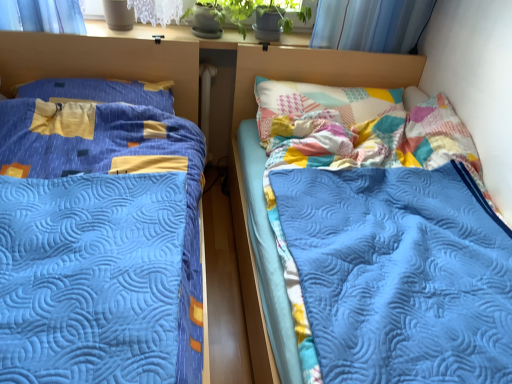
Find the location of a particular element. Image resolution: width=512 pixels, height=384 pixels. blue quilted bed at right, which is the second bed from left to right is located at coordinates (255, 143).

Describe the element at coordinates (255, 143) in the screenshot. I see `blue quilted bed at right, which is the second bed from left to right` at that location.

What is the approximate width of blue quilted bed at left, arranged as the 2th bed when viewed from the right?

It is 1.70 meters.

Measure the distance between point (172,45) and camera.

A distance of 6.53 feet exists between point (172,45) and camera.

Measure the distance between patchwork fabric headboard at upper right and camera.

The distance of patchwork fabric headboard at upper right from camera is 6.75 feet.

What do you see at coordinates (100, 91) in the screenshot? This screenshot has height=384, width=512. I see `matte blue pillow at left` at bounding box center [100, 91].

Find the location of `matte blue pillow at left`. matte blue pillow at left is located at coordinates (100, 91).

At what (x,y) coordinates should I click in order to perform the action: click on white matte radiator at center. Please return your answer as a coordinate pair (x, y). Looking at the image, I should click on (206, 101).

Which is correct: blue quilted bed at left, which is the 1th bed in left-to-right order, is inside patchwork fabric headboard at upper right, or outside of it?

blue quilted bed at left, which is the 1th bed in left-to-right order, lies outside patchwork fabric headboard at upper right.

How many degrees apart are the facing directions of blue quilted bed at left, arranged as the 2th bed when viewed from the right, and patchwork fabric headboard at upper right?

The angular difference between blue quilted bed at left, arranged as the 2th bed when viewed from the right, and patchwork fabric headboard at upper right is 0.00856 degrees.

Which bed is the 2nd one when counting from the front of the patchwork fabric headboard at upper right? Please provide its 2D coordinates.

[(106, 60)]

From a real-world perspective, is blue quilted bed at left, arranged as the 2th bed when viewed from the right, under patchwork fabric headboard at upper right?

Correct, in the physical world, blue quilted bed at left, arranged as the 2th bed when viewed from the right, is lower than patchwork fabric headboard at upper right.

Which is more to the right, matte blue pillow at left or blue quilted bed at left, arranged as the 2th bed when viewed from the right?

Positioned to the right is blue quilted bed at left, arranged as the 2th bed when viewed from the right.

Is matte blue pillow at left positioned before blue quilted bed at left, which is the 1th bed in left-to-right order?

No, matte blue pillow at left is behind blue quilted bed at left, which is the 1th bed in left-to-right order.

Could you tell me if matte blue pillow at left is turned towards blue quilted bed at left, arranged as the 2th bed when viewed from the right?

Yes, matte blue pillow at left is turned towards blue quilted bed at left, arranged as the 2th bed when viewed from the right.

From the image's perspective, between matte blue pillow at left and blue quilted bed at left, which is the 1th bed in left-to-right order, which one is located above?

matte blue pillow at left.

From the image's perspective, which object appears higher, white matte radiator at center or patchwork fabric headboard at upper right?

white matte radiator at center is shown above in the image.

Where is `radiator below the patchwork fabric headboard at upper right (from a real-world perspective)`? radiator below the patchwork fabric headboard at upper right (from a real-world perspective) is located at coordinates (206, 101).

Can you confirm if white matte radiator at center is positioned to the left of patchwork fabric headboard at upper right?

Yes.

Is matte blue pillow at left thinner than white matte radiator at center?

No, matte blue pillow at left is not thinner than white matte radiator at center.

From a real-world perspective, is matte blue pillow at left under white matte radiator at center?

Incorrect, from a real-world perspective, matte blue pillow at left is higher than white matte radiator at center.

From the picture: Is matte blue pillow at left situated inside white matte radiator at center or outside?

matte blue pillow at left lies outside white matte radiator at center.

Could you tell me if blue quilted bed at left, which is the 1th bed in left-to-right order, is turned towards matte blue pillow at left?

No, blue quilted bed at left, which is the 1th bed in left-to-right order, does not turn towards matte blue pillow at left.

How different are the orientations of blue quilted bed at left, arranged as the 2th bed when viewed from the right, and matte blue pillow at left in degrees?

The angle between the facing direction of blue quilted bed at left, arranged as the 2th bed when viewed from the right, and the facing direction of matte blue pillow at left is 2.97e-05 degrees.

Is blue quilted bed at left, arranged as the 2th bed when viewed from the right, closer to the viewer compared to matte blue pillow at left?

Yes, it is.

Considering the relative sizes of blue quilted bed at left, which is the 1th bed in left-to-right order, and matte blue pillow at left in the image provided, is blue quilted bed at left, which is the 1th bed in left-to-right order, thinner than matte blue pillow at left?

In fact, blue quilted bed at left, which is the 1th bed in left-to-right order, might be wider than matte blue pillow at left.

Would you say matte blue pillow at left is inside or outside blue quilted bed at right, which is the first bed from right to left?

matte blue pillow at left is outside blue quilted bed at right, which is the first bed from right to left.

Is matte blue pillow at left with blue quilted bed at right, which is the first bed from right to left?

No, matte blue pillow at left is not with blue quilted bed at right, which is the first bed from right to left.

Which is more distant, (56, 99) or (240, 214)?

The point (240, 214) is more distant.

Looking at the image, does matte blue pillow at left seem bigger or smaller compared to blue quilted bed at right, which is the first bed from right to left?

Clearly, matte blue pillow at left is smaller in size than blue quilted bed at right, which is the first bed from right to left.

Locate an element on the screen. pillow positioned vertically above the patchwork fabric headboard at upper right (from a real-world perspective) is located at coordinates (100, 91).

From a real-world perspective, is matte blue pillow at left above or below patchwork fabric headboard at upper right?

In terms of real-world spatial position, matte blue pillow at left is above patchwork fabric headboard at upper right.

Is matte blue pillow at left not inside patchwork fabric headboard at upper right?

Yes, matte blue pillow at left is not within patchwork fabric headboard at upper right.

At what (x,y) coordinates should I click in order to perform the action: click on the 1st bed positioned below the patchwork fabric headboard at upper right (from the image's perspective). Please return your answer as a coordinate pair (x, y). The height and width of the screenshot is (384, 512). Looking at the image, I should click on (106, 60).

From a real-world perspective, starting from the matte blue pillow at left, which bed is the 1st one below it? Please provide its 2D coordinates.

[(106, 60)]

Based on the photo, based on their spatial positions, is white matte radiator at center or matte blue pillow at left closer to patchwork fabric headboard at upper right?

white matte radiator at center lies closer to patchwork fabric headboard at upper right than the other object.

Based on their spatial positions, is patchwork fabric headboard at upper right or blue quilted bed at left, which is the 1th bed in left-to-right order, closer to white matte radiator at center?

The object closer to white matte radiator at center is blue quilted bed at left, which is the 1th bed in left-to-right order.

Which object lies further to the anchor point blue quilted bed at left, arranged as the 2th bed when viewed from the right, white matte radiator at center or matte blue pillow at left?

white matte radiator at center is positioned further to the anchor blue quilted bed at left, arranged as the 2th bed when viewed from the right.

Considering their positions, is matte blue pillow at left positioned closer to blue quilted bed at right, which is the first bed from right to left, than patchwork fabric headboard at upper right?

The object closer to blue quilted bed at right, which is the first bed from right to left, is patchwork fabric headboard at upper right.

From the picture: When comparing their distances from blue quilted bed at left, arranged as the 2th bed when viewed from the right, does white matte radiator at center or blue quilted bed at right, which is the second bed from left to right, seem closer?

white matte radiator at center is closer to blue quilted bed at left, arranged as the 2th bed when viewed from the right.

Considering their positions, is patchwork fabric headboard at upper right positioned further to blue quilted bed at right, which is the first bed from right to left, than matte blue pillow at left?

matte blue pillow at left.

Considering their positions, is white matte radiator at center positioned further to blue quilted bed at right, which is the first bed from right to left, than blue quilted bed at left, which is the 1th bed in left-to-right order?

Based on the image, blue quilted bed at left, which is the 1th bed in left-to-right order, appears to be further to blue quilted bed at right, which is the first bed from right to left.

Which object lies nearer to the anchor point matte blue pillow at left, blue quilted bed at right, which is the first bed from right to left, or white matte radiator at center?

Based on the image, white matte radiator at center appears to be nearer to matte blue pillow at left.

Where is `radiator between matte blue pillow at left and patchwork fabric headboard at upper right`? radiator between matte blue pillow at left and patchwork fabric headboard at upper right is located at coordinates (206, 101).

At what (x,y) coordinates should I click in order to perform the action: click on pillow positioned between blue quilted bed at left, which is the 1th bed in left-to-right order, and white matte radiator at center from near to far. Please return your answer as a coordinate pair (x, y). Looking at the image, I should click on (100, 91).

Find the location of a particular element. headboard positioned between blue quilted bed at left, which is the 1th bed in left-to-right order, and white matte radiator at center from near to far is located at coordinates (318, 71).

At what (x,y) coordinates should I click in order to perform the action: click on headboard between matte blue pillow at left and blue quilted bed at right, which is the first bed from right to left, in the horizontal direction. Please return your answer as a coordinate pair (x, y). Image resolution: width=512 pixels, height=384 pixels. Looking at the image, I should click on (318, 71).